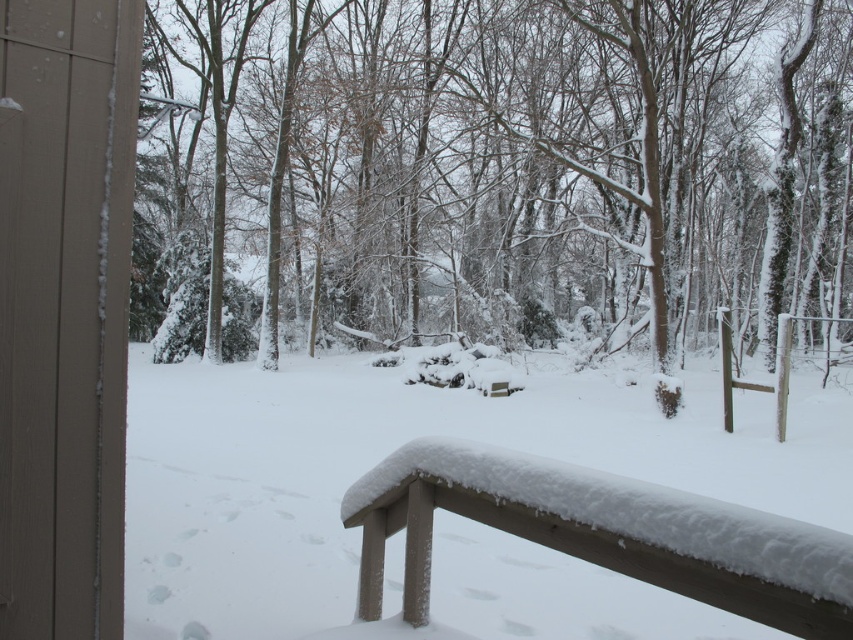
From the picture: You are standing on the wooden railing covered in fresh snow and want to move towards the dense forest of bare trees. There are two points marked on the railing at coordinates point [451,72] and point [221,561]. Which point should you step on first to move towards the forest?

You should step on point [221,561] first because point [451,72] is behind it, meaning point [221,561] is closer to the forest direction.